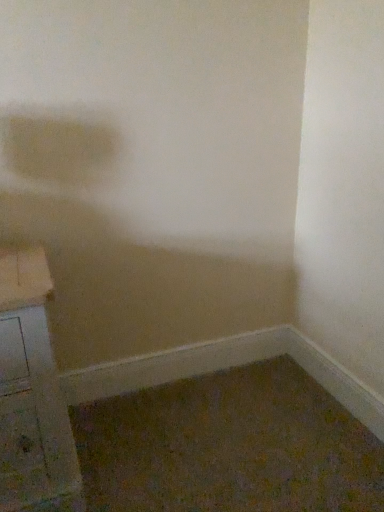
Locate an element on the screen. empty space that is ontop of wooden file cabinet at lower left (from a real-world perspective) is located at coordinates (21, 262).